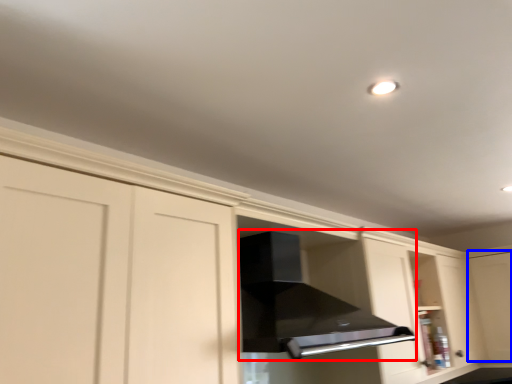
Question: Among these objects, which one is farthest to the camera, vent (highlighted by a red box) or glass door (highlighted by a blue box)?

Choices:
 (A) vent
 (B) glass door

Answer: (B)